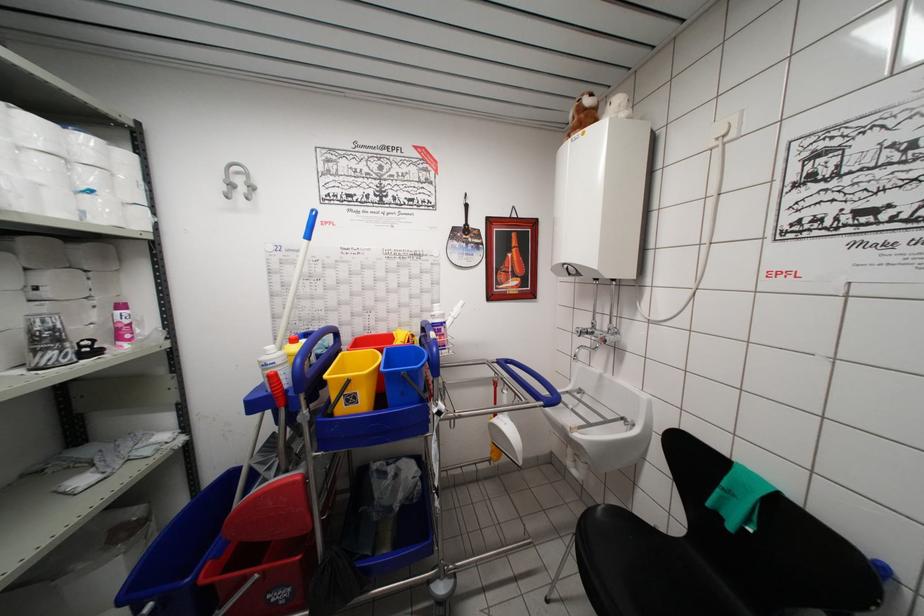
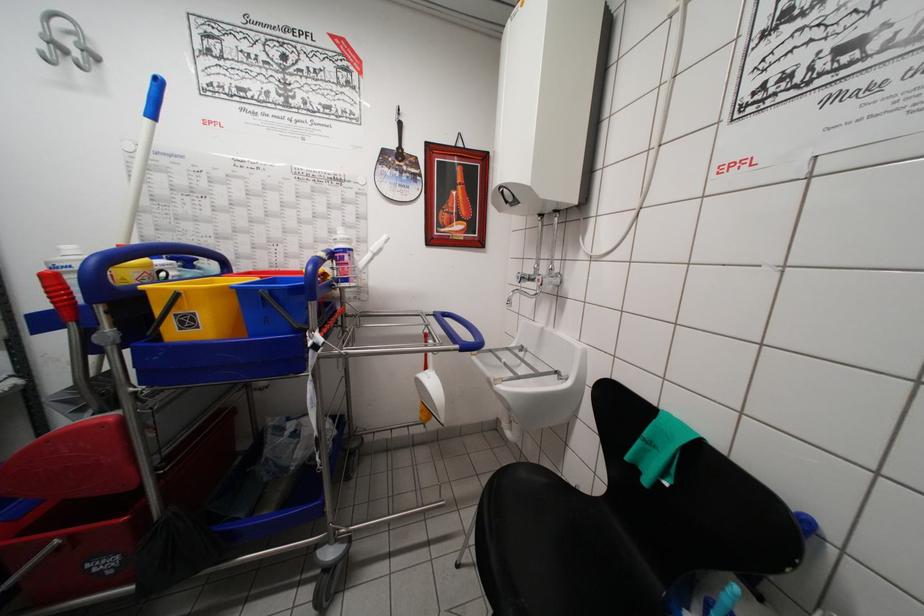
Locate, in the second image, the point that corresponds to (544,408) in the first image.

(460, 351)